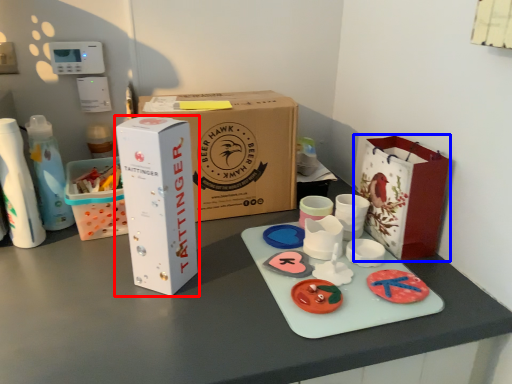
Question: Among these objects, which one is farthest to the camera, box (highlighted by a red box) or paper bag (highlighted by a blue box)?

Choices:
 (A) box
 (B) paper bag

Answer: (B)